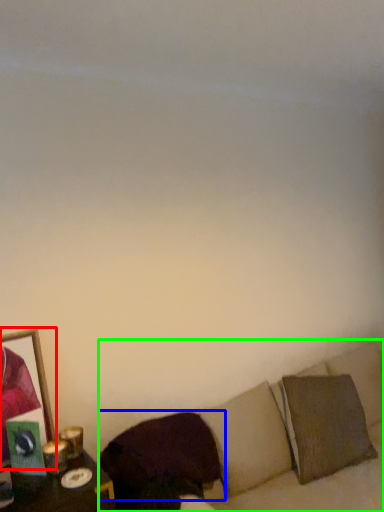
Question: Which object is the farthest from picture frame (highlighted by a red box)? Choose among these: pillow (highlighted by a blue box) or couch (highlighted by a green box).

Choices:
 (A) pillow
 (B) couch

Answer: (B)